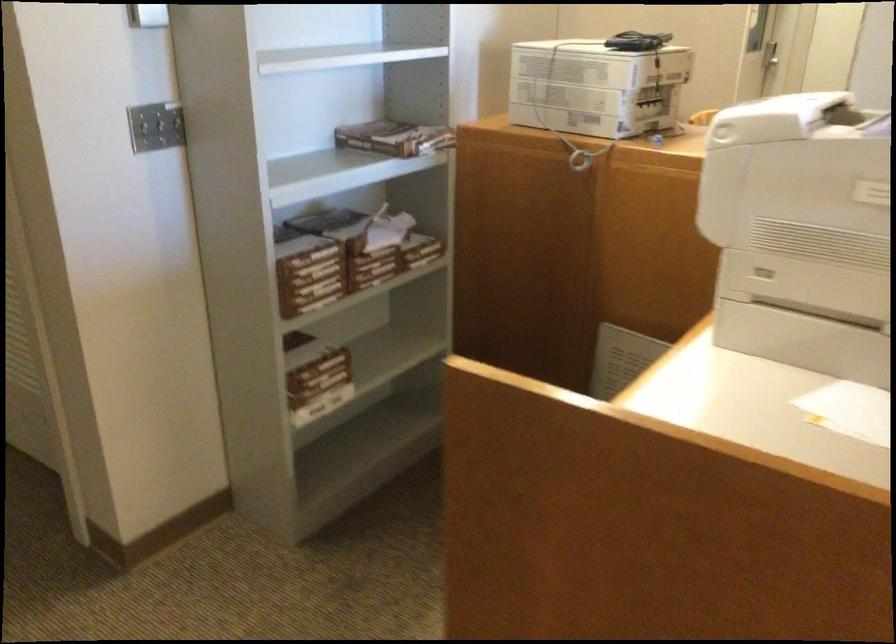
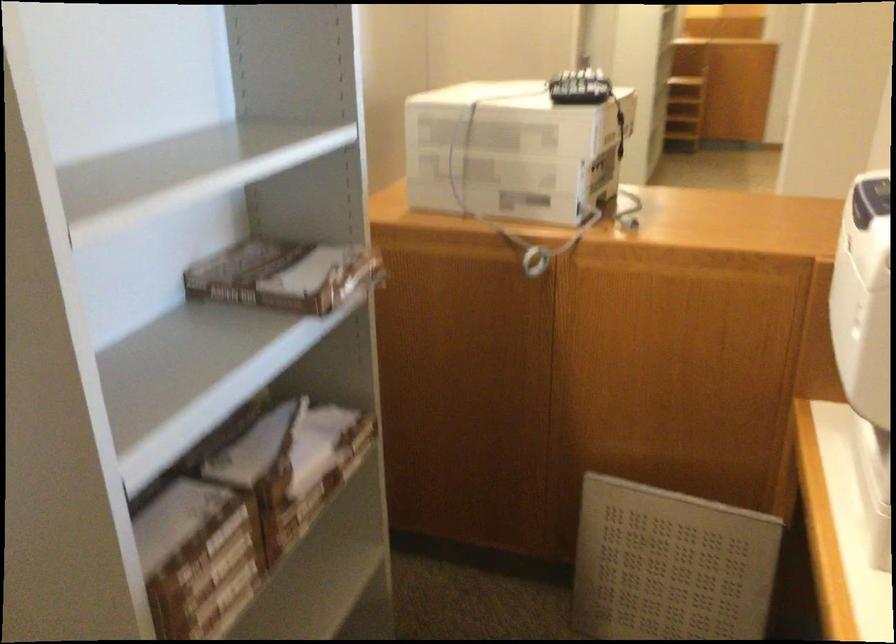
Question: The images are taken continuously from a first-person perspective. In which direction are you moving?

Choices:
 (A) Left
 (B) Right
 (C) Forward
 (D) Backward

Answer: (C)